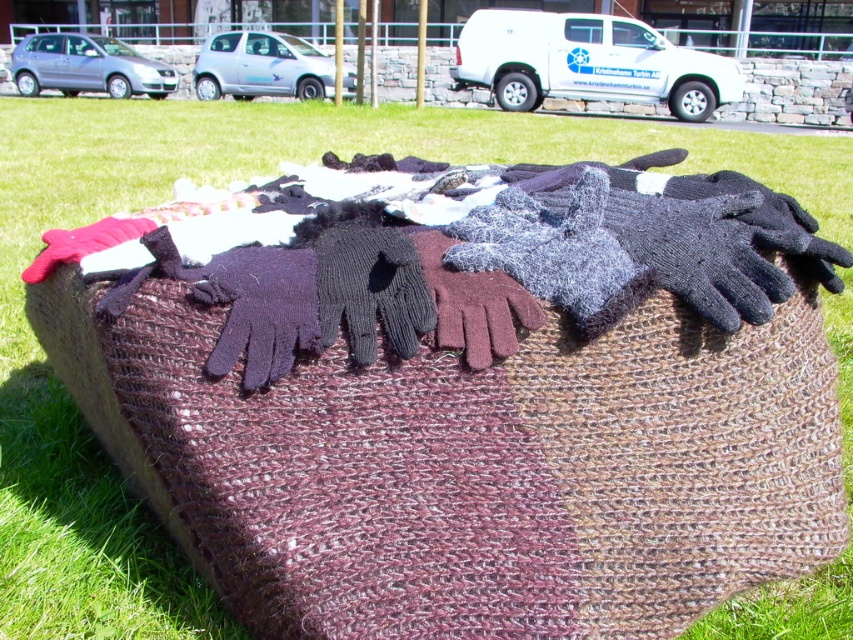
Question: Can you confirm if gray knitted gloves at center is positioned above maroon knitted glove at center?

Choices:
 (A) yes
 (B) no

Answer: (A)

Question: Can you confirm if gray knitted gloves at center is smaller than maroon knitted glove at center?

Choices:
 (A) no
 (B) yes

Answer: (A)

Question: Which point appears farthest from the camera in this image?

Choices:
 (A) (438, 304)
 (B) (527, 276)

Answer: (B)

Question: Is gray knitted gloves at center below maroon knitted glove at center?

Choices:
 (A) no
 (B) yes

Answer: (A)